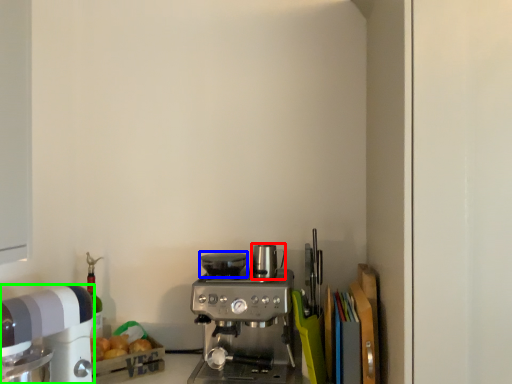
Question: Estimate the real-world distances between objects in this image. Which object is closer to appliance (highlighted by a red box), appliance (highlighted by a blue box) or kitchen appliance (highlighted by a green box)?

Choices:
 (A) appliance
 (B) kitchen appliance

Answer: (A)